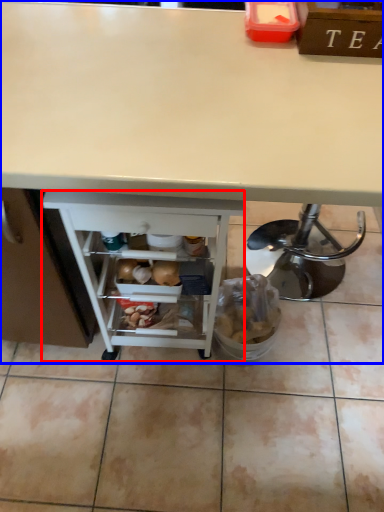
Question: Among these objects, which one is farthest to the camera, shelf (highlighted by a red box) or desk (highlighted by a blue box)?

Choices:
 (A) shelf
 (B) desk

Answer: (A)